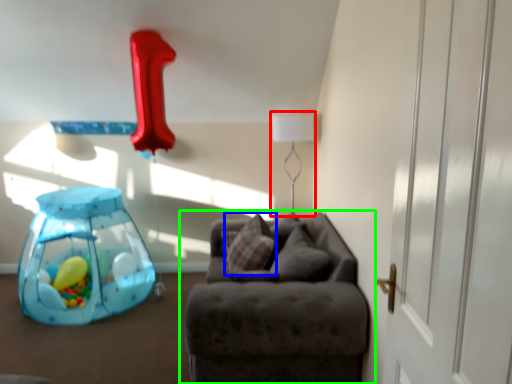
Question: Which object is positioned farthest from table lamp (highlighted by a red box)? Select from pillow (highlighted by a blue box) and studio couch (highlighted by a green box).

Choices:
 (A) pillow
 (B) studio couch

Answer: (B)